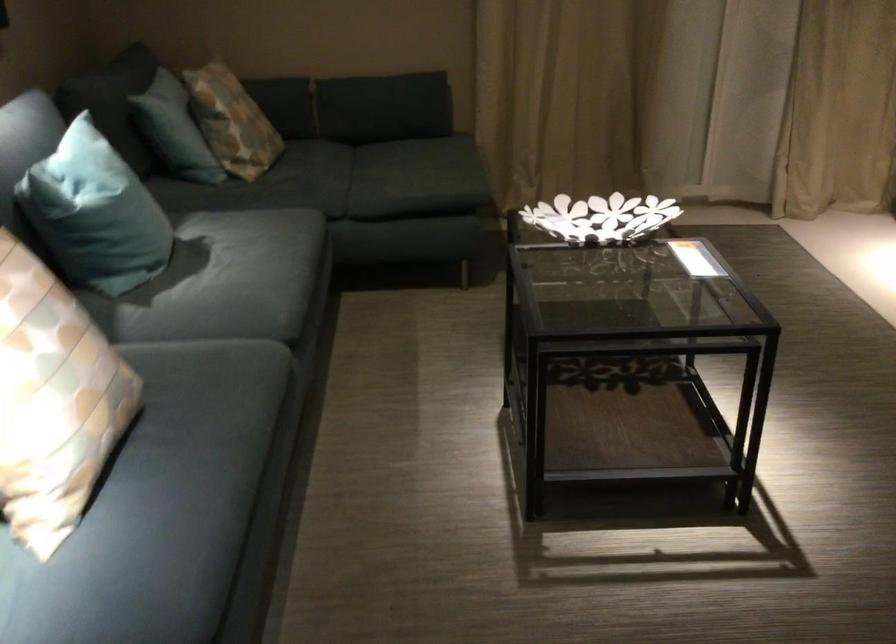
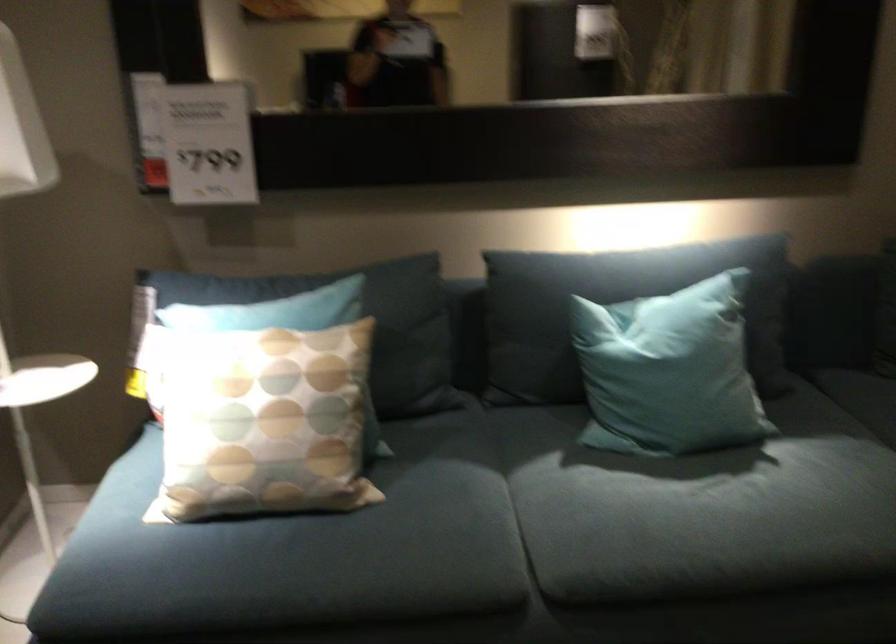
In the second image, find the point that corresponds to point (140, 205) in the first image.

(668, 371)